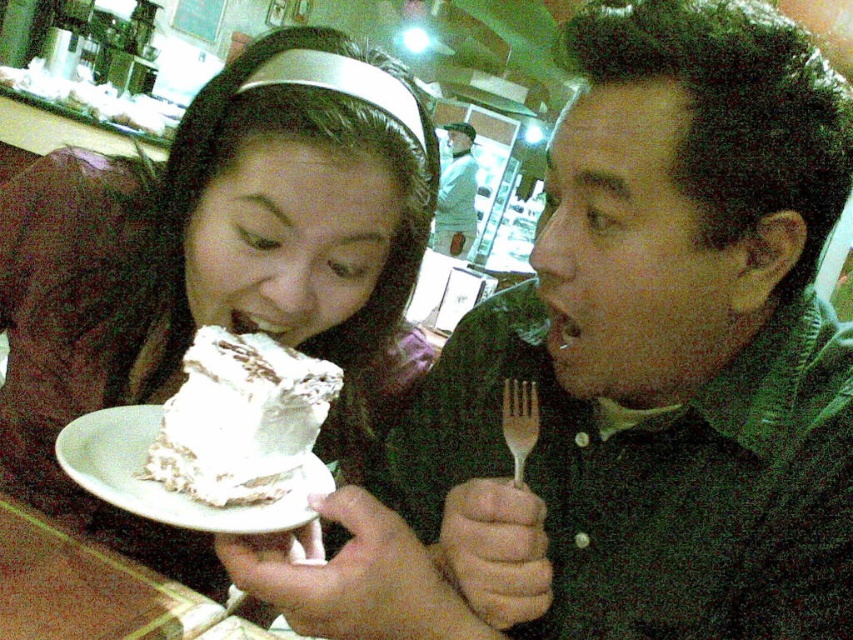
You are a chef who needs to serve a dessert plate that includes both the white frosted cake at center and the wooden fork at center. Based on their sizes, which item should be placed first to ensure proper arrangement?

The white frosted cake at center is larger than the wooden fork at center, so it should be placed first to ensure proper arrangement.

You are a waiter in a restaurant and need to place a new order of a cake on the table. The cake comes with a matte black fork at upper right and a white matte plate at lower left. However, the table is very small. Can you determine which item takes up more vertical space on the table?

The matte black fork at upper right is much taller than the white matte plate at lower left, so it takes up more vertical space on the table.